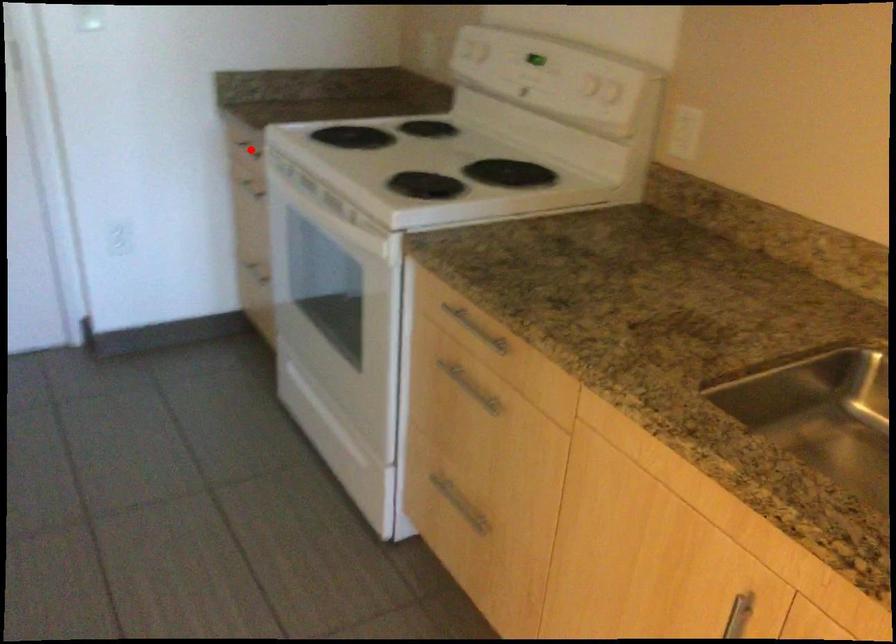
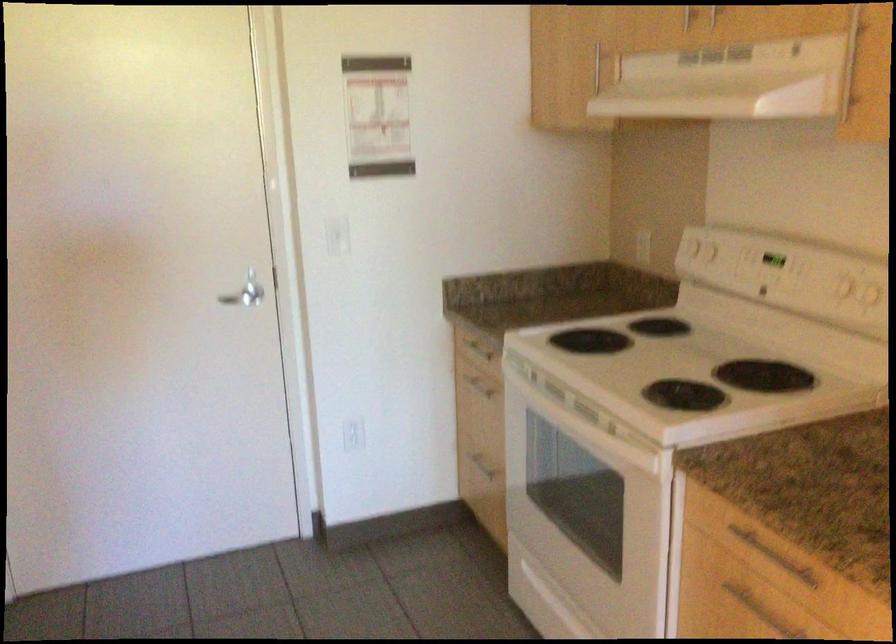
In the second image, find the point that corresponds to the highlighted location in the first image.

(476, 346)